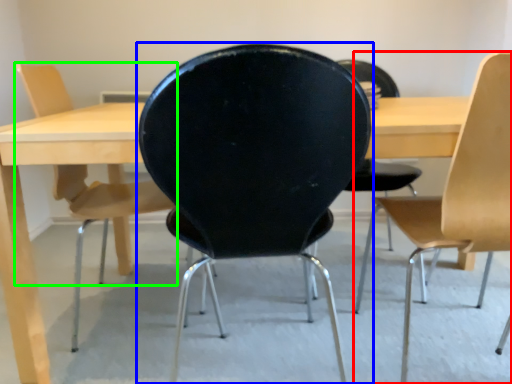
Question: Which object is positioned farthest from chair (highlighted by a red box)? Select from chair (highlighted by a blue box) and chair (highlighted by a green box).

Choices:
 (A) chair
 (B) chair

Answer: (B)